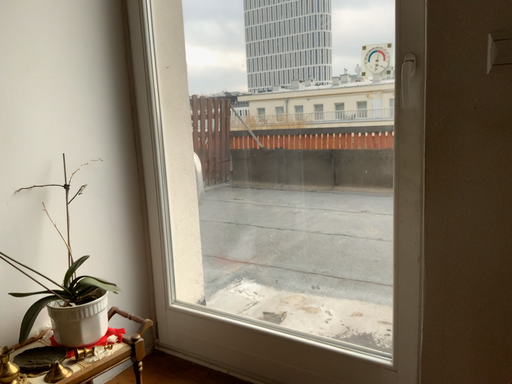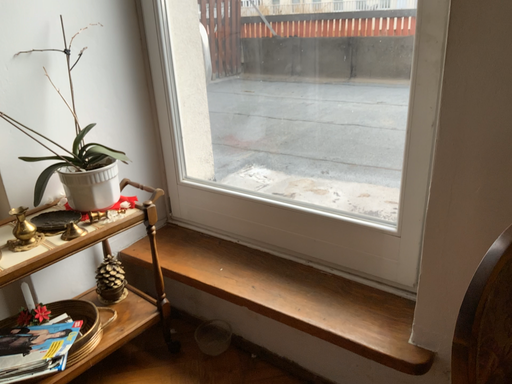
Question: How did the camera likely rotate when shooting the video?

Choices:
 (A) rotated downward
 (B) rotated upward

Answer: (A)